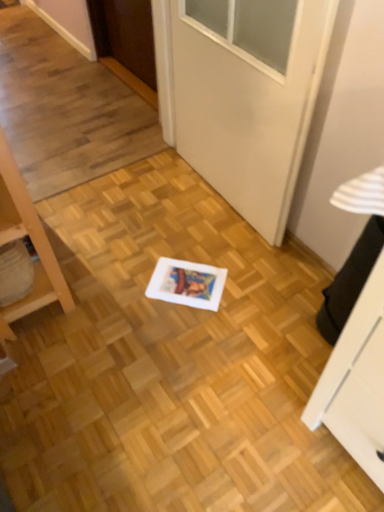
What do you see at coordinates (248, 97) in the screenshot?
I see `white glossy door at center` at bounding box center [248, 97].

Where is `white glossy door at center`? The width and height of the screenshot is (384, 512). white glossy door at center is located at coordinates (248, 97).

Identify the location of white glossy door at center. (248, 97).